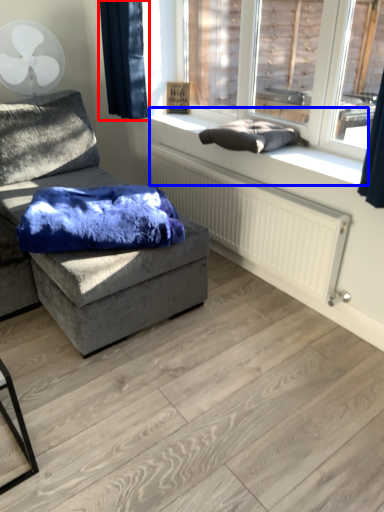
Question: Which object appears farthest to the camera in this image, curtain (highlighted by a red box) or window sill (highlighted by a blue box)?

Choices:
 (A) curtain
 (B) window sill

Answer: (A)